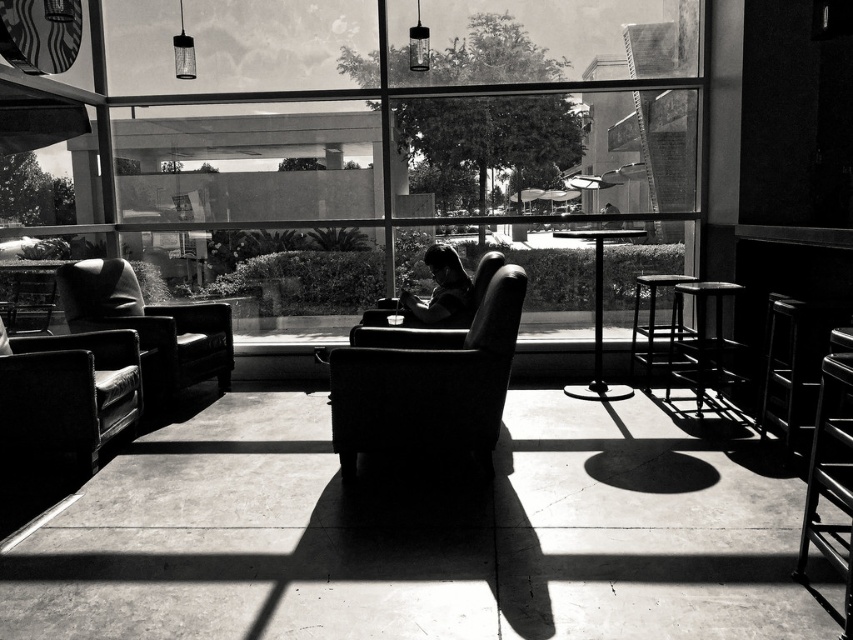
Question: Does leather armchair at lower left appear under metallic stool at right?

Choices:
 (A) no
 (B) yes

Answer: (B)

Question: Among these points, which one is farthest from the camera?

Choices:
 (A) (590, 378)
 (B) (109, 273)
 (C) (73, 374)
 (D) (688, 292)

Answer: (A)

Question: Estimate the real-world distances between objects in this image. Which object is farther from the black metal stool at right?

Choices:
 (A) leather armchair at lower left
 (B) smooth leather armchair at center

Answer: (A)

Question: Does transparent glass window at center have a lesser width compared to metallic stool at right?

Choices:
 (A) no
 (B) yes

Answer: (A)

Question: Does leather armchair at lower left have a larger size compared to smooth black stool at right?

Choices:
 (A) no
 (B) yes

Answer: (A)

Question: Among these points, which one is farthest from the camera?

Choices:
 (A) (842, 312)
 (B) (677, 289)
 (C) (225, 310)
 (D) (654, 326)

Answer: (D)